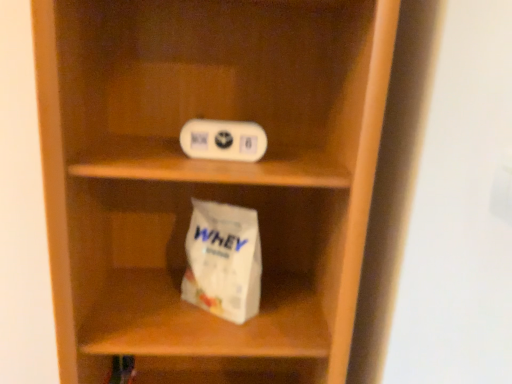
Question: Can you confirm if wooden shelf at center is bigger than white matte paper bag at lower center?

Choices:
 (A) yes
 (B) no

Answer: (A)

Question: Is the depth of wooden shelf at center greater than that of white matte paper bag at lower center?

Choices:
 (A) yes
 (B) no

Answer: (B)

Question: Is wooden shelf at center looking in the opposite direction of white matte paper bag at lower center?

Choices:
 (A) yes
 (B) no

Answer: (A)

Question: Is wooden shelf at center closer to camera compared to white matte paper bag at lower center?

Choices:
 (A) yes
 (B) no

Answer: (A)

Question: Is wooden shelf at center at the left side of white matte paper bag at lower center?

Choices:
 (A) yes
 (B) no

Answer: (A)

Question: In terms of height, does white matte paper bag at lower center look taller or shorter compared to white plastic ipod at upper center?

Choices:
 (A) tall
 (B) short

Answer: (A)

Question: In terms of width, does white matte paper bag at lower center look wider or thinner when compared to white plastic ipod at upper center?

Choices:
 (A) wide
 (B) thin

Answer: (A)

Question: From the image's perspective, relative to white plastic ipod at upper center, is white matte paper bag at lower center above or below?

Choices:
 (A) below
 (B) above

Answer: (A)

Question: From a real-world perspective, relative to white plastic ipod at upper center, is white matte paper bag at lower center vertically above or below?

Choices:
 (A) above
 (B) below

Answer: (B)

Question: Is wooden shelf at center situated inside white plastic ipod at upper center or outside?

Choices:
 (A) inside
 (B) outside

Answer: (B)

Question: Is wooden shelf at center bigger or smaller than white plastic ipod at upper center?

Choices:
 (A) big
 (B) small

Answer: (A)

Question: Considering the positions of point (71, 294) and point (181, 140), is point (71, 294) closer or farther from the camera than point (181, 140)?

Choices:
 (A) farther
 (B) closer

Answer: (B)

Question: In terms of width, does wooden shelf at center look wider or thinner when compared to white plastic ipod at upper center?

Choices:
 (A) thin
 (B) wide

Answer: (B)

Question: Is wooden shelf at center situated inside white matte paper bag at lower center or outside?

Choices:
 (A) outside
 (B) inside

Answer: (A)

Question: Is wooden shelf at center bigger or smaller than white matte paper bag at lower center?

Choices:
 (A) big
 (B) small

Answer: (A)